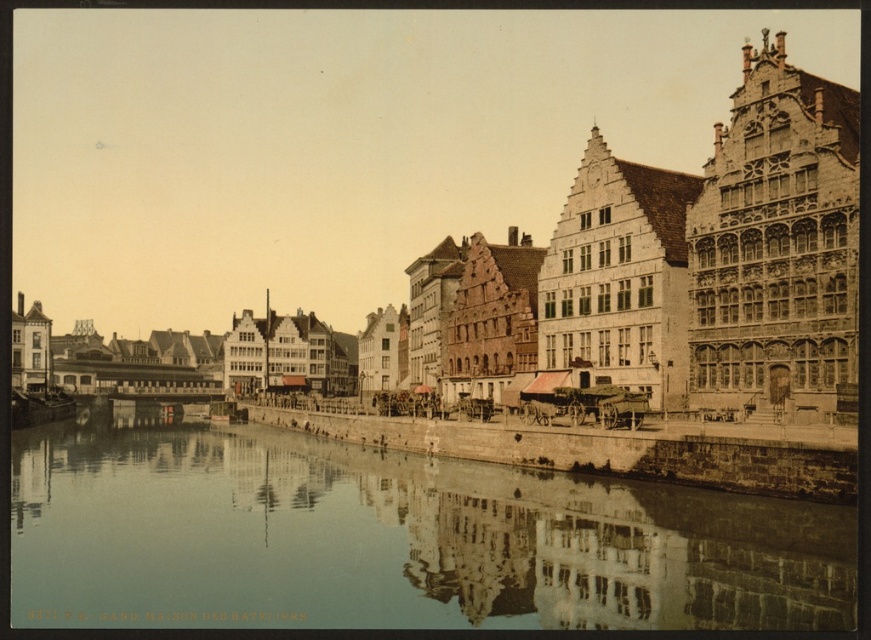
You are a tourist standing on the riverside path and want to take a photo of the stone building at center and the smooth concrete river at center. Which object should you focus on first if you want to capture both in one frame without moving the camera?

The stone building at center is taller than the smooth concrete river at center, so you should focus on the stone building at center first to ensure it fits within the frame.

You are standing at the center of the historic riverside town. Which building is exactly at the point marked by coordinates (458, 195)?

The stone building at center is located at point (458, 195).